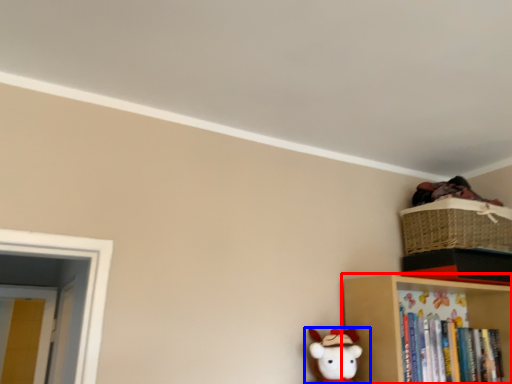
Question: Which point is further to the camera, shelf (highlighted by a red box) or toy (highlighted by a blue box)?

Choices:
 (A) shelf
 (B) toy

Answer: (A)